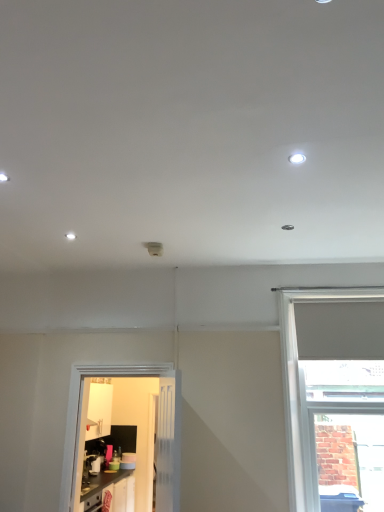
Question: From a real-world perspective, is white matte window at right physically located above or below white glossy door at lower left?

Choices:
 (A) below
 (B) above

Answer: (B)

Question: Choose the correct answer: Is white matte window at right inside white glossy door at lower left or outside it?

Choices:
 (A) outside
 (B) inside

Answer: (A)

Question: Considering the real-world distances, which object is farthest from the white glossy door at lower left?

Choices:
 (A) white matte window at right
 (B) white glossy light fixture at upper right
 (C) matte black cabinets at lower left

Answer: (B)

Question: Which of these objects is positioned farthest from the white glossy light fixture at upper right?

Choices:
 (A) white matte window at right
 (B) matte black cabinets at lower left
 (C) white glossy door at lower left

Answer: (C)